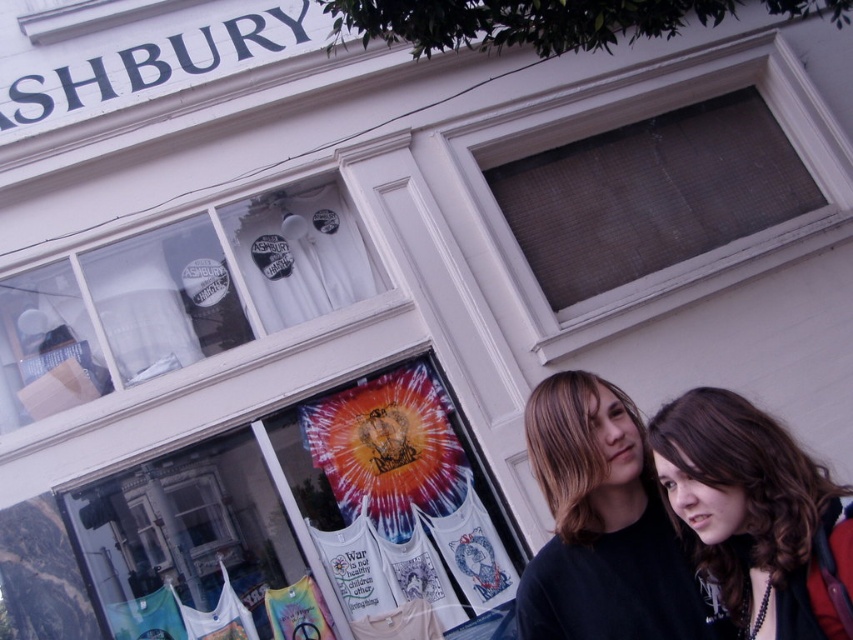
Looking at this image, you are standing in front of the ASHBURY store and want to see the sunburst design shirt displayed in the matte glass window at upper center. Since the window is at point (650, 195), can you see the shirt from your current position?

The matte glass window at upper center is located at point (650, 195). Since you are standing in front of the store, you can see the sunburst design shirt displayed in the matte glass window at upper center from your current position.

You are a delivery person trying to deliver a package to the ASHBURY shop. You see the matte glass window at upper center and the brown curly hair at center. Which object is higher in the scene?

The matte glass window at upper center is higher than brown curly hair at center because it is located above it.

You are standing in front of the ASHBURY store and want to take a photo of the point at coordinate point (694, 211). The camera you are using has a focal length of 50mm and a sensor size of 24mm x 36mm. The distance from the camera to the point is 7.40 meters. Calculate the angle of view required to capture the point in the frame. Use the formula angle of view in degrees equals 2 times arctangent of half the sensor dimension divided by focal length. Which sensor dimension should you use for the angle of

The point (694, 211) is 7.40 meters away from the camera. To calculate the angle of view, use the sensor dimension corresponding to the direction perpendicular to the camera axis. Since the sensor size is 24mm x 36mm, the horizontal dimension is 36mm and vertical is 24mm. The angle of view formula requires knowing whether the point is along the horizontal or vertical axis. However, the coordinate system here might be normalized, so assuming the point is within the frame, the angle can be calculated using